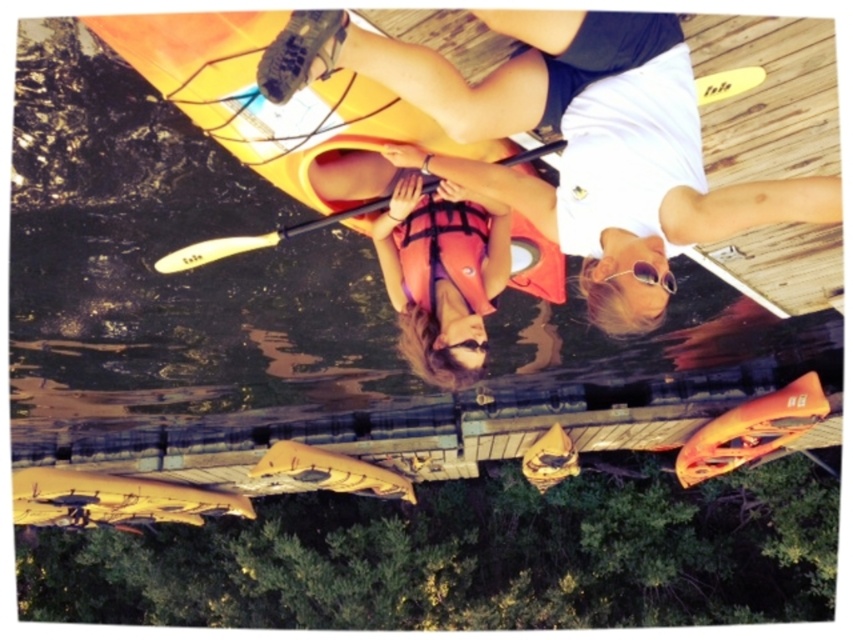
Question: Which point is closer to the camera?

Choices:
 (A) matte orange kayak at upper center
 (B) wooden smooth paddle at center
 (C) orange life vest at center
 (D) orange mesh life jacket at center

Answer: (A)

Question: Is matte orange kayak at upper center positioned at the back of wooden smooth paddle at center?

Choices:
 (A) yes
 (B) no

Answer: (B)

Question: Does orange mesh life jacket at center have a lesser width compared to wooden smooth paddle at center?

Choices:
 (A) yes
 (B) no

Answer: (A)

Question: Is matte orange kayak at upper center to the right of orange life vest at center from the viewer's perspective?

Choices:
 (A) yes
 (B) no

Answer: (A)

Question: Among these objects, which one is nearest to the camera?

Choices:
 (A) matte orange kayak at upper center
 (B) white plastic paddle at center

Answer: (A)

Question: Which of the following is the closest to the observer?

Choices:
 (A) (235, 241)
 (B) (498, 266)
 (C) (326, 22)

Answer: (C)